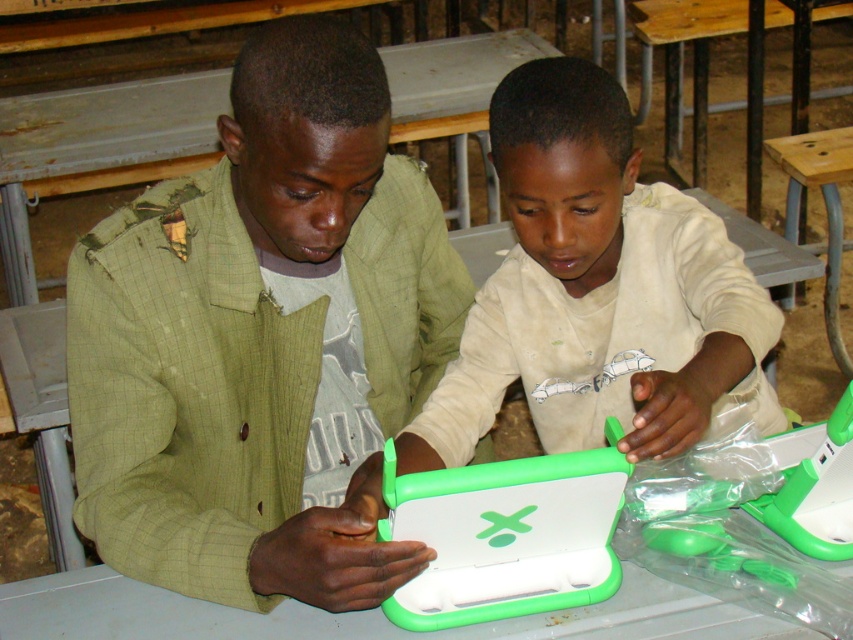
This screenshot has height=640, width=853. Identify the location of green matte laptop at center. (262, 339).

The height and width of the screenshot is (640, 853). What do you see at coordinates (262, 339) in the screenshot? I see `green matte laptop at center` at bounding box center [262, 339].

This screenshot has width=853, height=640. Identify the location of green matte laptop at center. (262, 339).